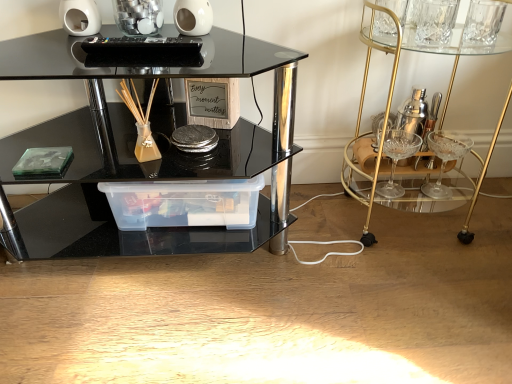
Question: From the image's perspective, is black glass table at center located above gold glass bar cart at right?

Choices:
 (A) no
 (B) yes

Answer: (A)

Question: Is black glass table at center outside gold glass bar cart at right?

Choices:
 (A) no
 (B) yes

Answer: (B)

Question: Is black glass table at center bigger than gold glass bar cart at right?

Choices:
 (A) yes
 (B) no

Answer: (A)

Question: Is gold glass bar cart at right surrounded by black glass table at center?

Choices:
 (A) no
 (B) yes

Answer: (A)

Question: Can you confirm if black glass table at center is thinner than gold glass bar cart at right?

Choices:
 (A) no
 (B) yes

Answer: (A)

Question: Are black glass table at center and gold glass bar cart at right located far from each other?

Choices:
 (A) no
 (B) yes

Answer: (A)

Question: Does transparent plastic container at center have a larger size compared to black glass table at center?

Choices:
 (A) no
 (B) yes

Answer: (A)

Question: Is transparent plastic container at center at the right side of black glass table at center?

Choices:
 (A) no
 (B) yes

Answer: (B)

Question: From a real-world perspective, is transparent plastic container at center over black glass table at center?

Choices:
 (A) yes
 (B) no

Answer: (B)

Question: Is transparent plastic container at center smaller than black glass table at center?

Choices:
 (A) yes
 (B) no

Answer: (A)

Question: From the image's perspective, is transparent plastic container at center on top of black glass table at center?

Choices:
 (A) no
 (B) yes

Answer: (A)

Question: Is the position of transparent plastic container at center less distant than that of black glass table at center?

Choices:
 (A) yes
 (B) no

Answer: (B)

Question: Is gold glass bar cart at right at the left side of transparent plastic container at center?

Choices:
 (A) yes
 (B) no

Answer: (B)